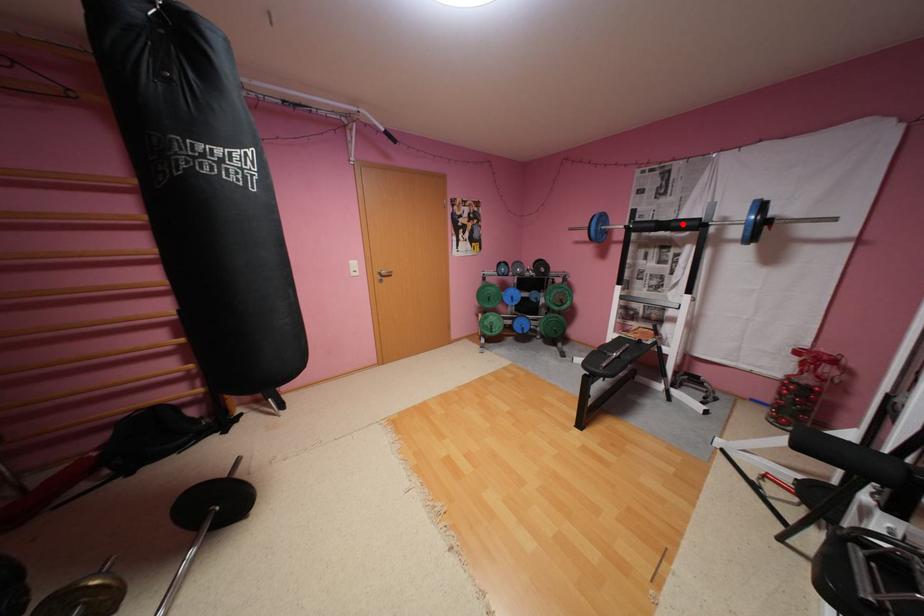
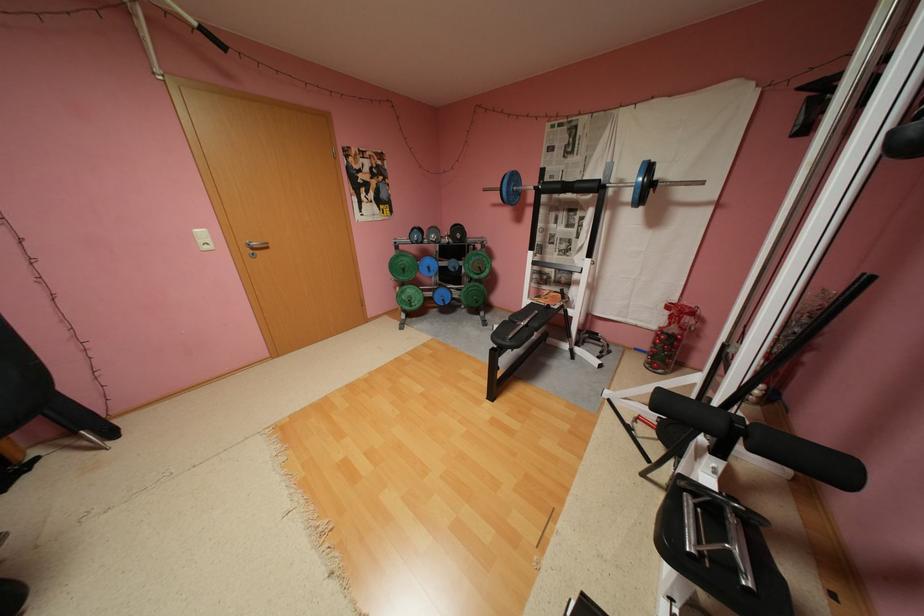
Where in the second image is the point corresponding to the highlighted location from the first image?

(586, 185)